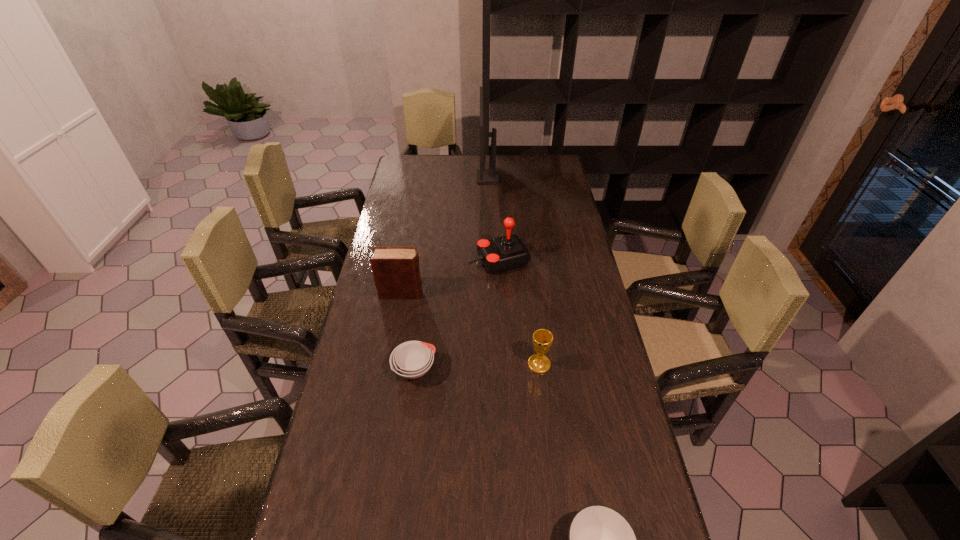
The image size is (960, 540). In the image, there is a desktop. In order to click on vacant space at the far left corner in this screenshot , I will do `click(428, 162)`.

In the image, there is a desktop. Where is `blank space at the far right corner`? Image resolution: width=960 pixels, height=540 pixels. blank space at the far right corner is located at coordinates (536, 161).

The height and width of the screenshot is (540, 960). Find the location of `blank region between the farthest object and the diary`. blank region between the farthest object and the diary is located at coordinates (444, 235).

Image resolution: width=960 pixels, height=540 pixels. I want to click on free point between the tallest object and the chalice, so click(514, 271).

Where is `empty space that is in between the joystick and the chalice`? empty space that is in between the joystick and the chalice is located at coordinates (519, 312).

This screenshot has width=960, height=540. I want to click on free spot between the chalice and the tallest object, so click(x=514, y=271).

This screenshot has width=960, height=540. I want to click on vacant region between the third farthest object and the second farthest object, so click(x=450, y=277).

Locate an element on the screen. The height and width of the screenshot is (540, 960). free point between the third shortest object and the third farthest object is located at coordinates point(470,329).

Where is `vacant area that lies between the chalice and the diary`? vacant area that lies between the chalice and the diary is located at coordinates (470, 329).

Select which object is the second closest to the second shortest object. Please provide its 2D coordinates. Your answer should be formatted as a tuple, i.e. [(x, y)], where the tuple contains the x and y coordinates of a point satisfying the conditions above.

[(412, 359)]